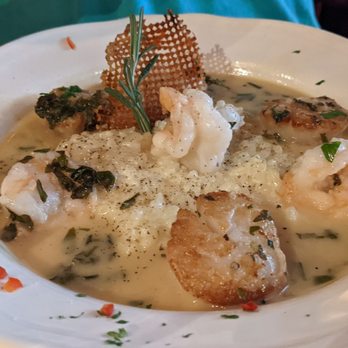
Where is `rim of plate`? This screenshot has width=348, height=348. rim of plate is located at coordinates (252, 40).